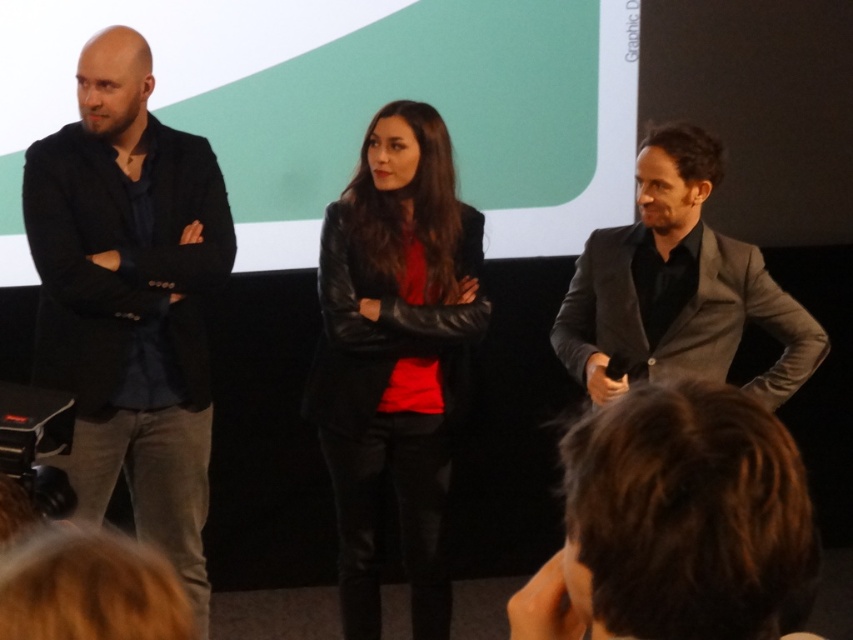
Does black leather jacket at left appear on the right side of gray wool suit at right?

Incorrect, black leather jacket at left is not on the right side of gray wool suit at right.

Is black leather jacket at left behind gray wool suit at right?

Yes, it is behind gray wool suit at right.

Between point (97, 189) and point (650, 236), which one is positioned behind?

Positioned behind is point (650, 236).

In order to click on black leather jacket at left in this screenshot , I will do `click(131, 298)`.

Who is positioned more to the left, black leather jacket at left or leather jacket at center?

black leather jacket at left is more to the left.

Who is more distant from viewer, (204,369) or (354,310)?

Point (354,310)

Between point (57, 164) and point (436, 529), which one is positioned in front?

Point (57, 164) is more forward.

Where is `black leather jacket at left`? This screenshot has width=853, height=640. black leather jacket at left is located at coordinates (131, 298).

Measure the distance between leather jacket at center and gray wool suit at right.

They are 25.28 inches apart.

Find the location of a particular element. This screenshot has height=640, width=853. leather jacket at center is located at coordinates (393, 356).